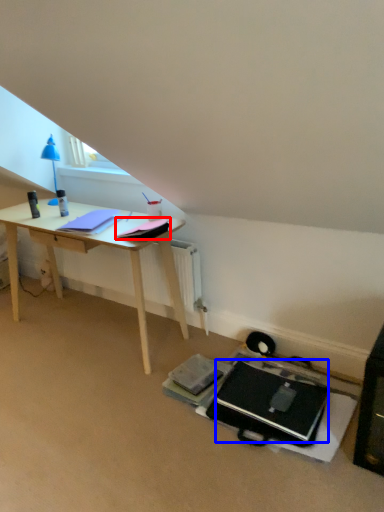
Question: Which object appears closest to the camera in this image, notepad (highlighted by a red box) or laptop (highlighted by a blue box)?

Choices:
 (A) notepad
 (B) laptop

Answer: (B)